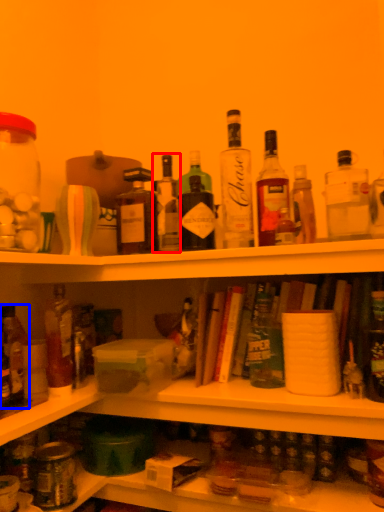
Question: Which of the following is the farthest to the observer, bottle (highlighted by a red box) or bottle (highlighted by a blue box)?

Choices:
 (A) bottle
 (B) bottle

Answer: (A)